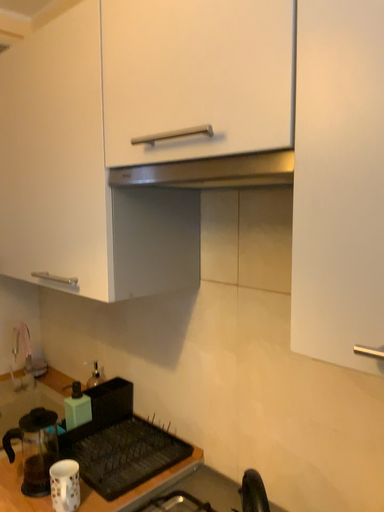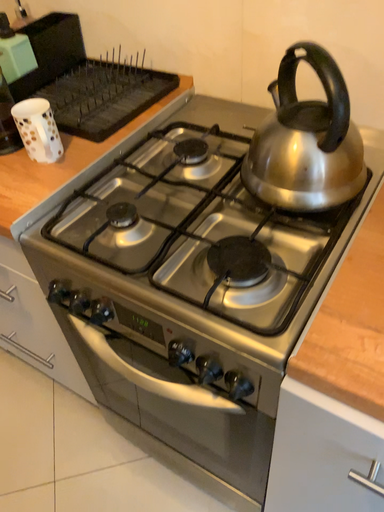
Question: Which way did the camera rotate in the video?

Choices:
 (A) rotated downward
 (B) rotated upward

Answer: (A)